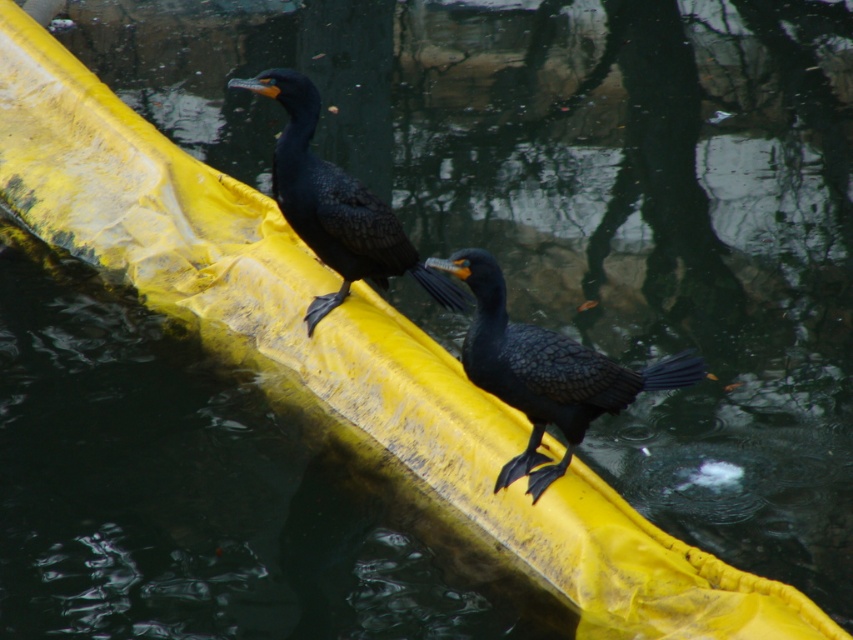
From the picture: Between shiny black bird at center and shiny black cormorant at upper center, which one is positioned lower?

shiny black bird at center is lower down.

Is shiny black bird at center closer to camera compared to shiny black cormorant at upper center?

Yes.

Does point (563, 419) lie in front of point (315, 96)?

Yes, it is.

Where is `shiny black bird at center`? This screenshot has width=853, height=640. shiny black bird at center is located at coordinates (544, 371).